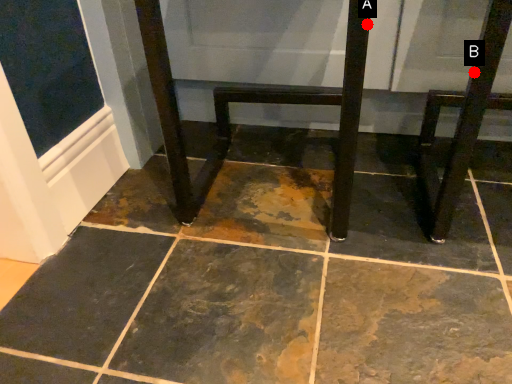
Question: Two points are circled on the image, labeled by A and B beside each circle. Which point is closer to the camera?

Choices:
 (A) A is closer
 (B) B is closer

Answer: (A)